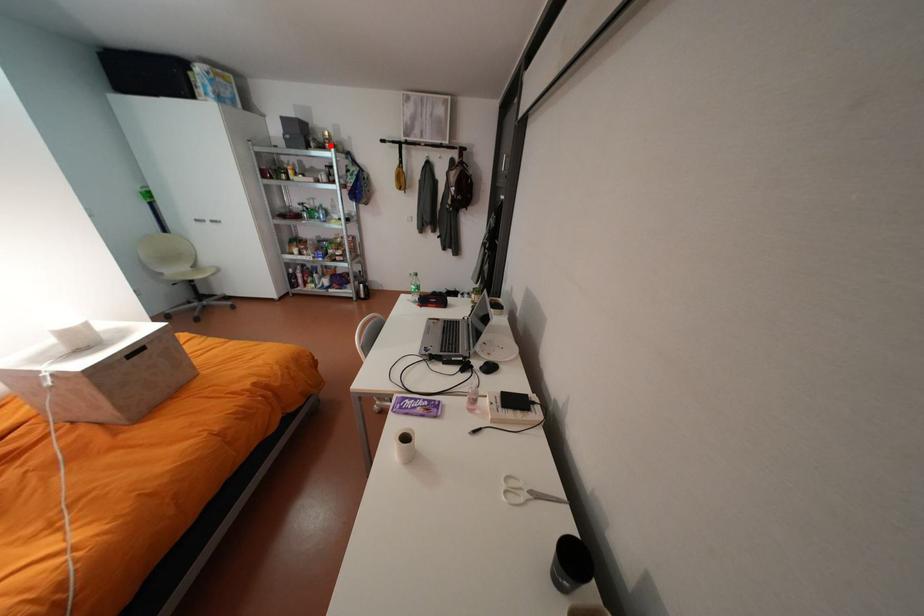
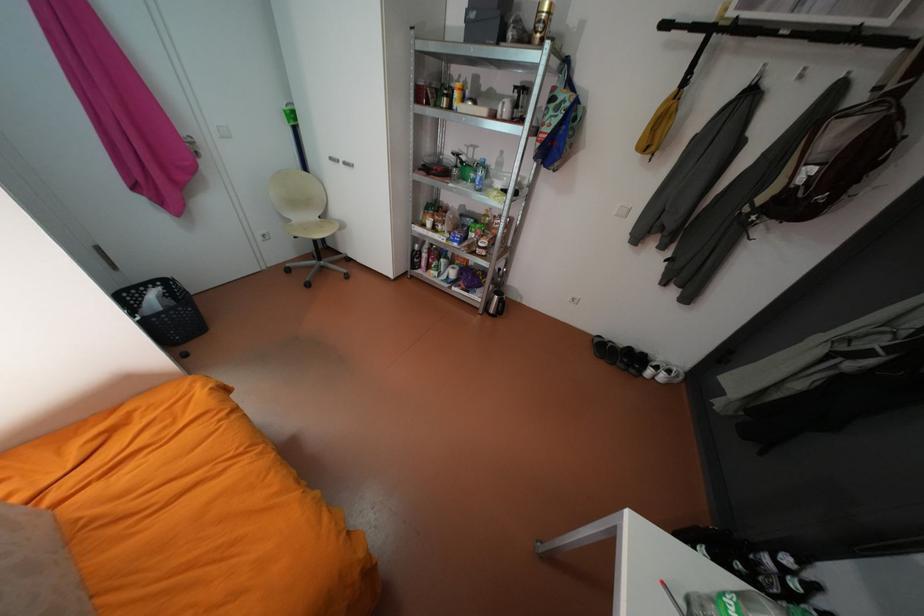
Question: I am providing you with two images of the same scene from different viewpoints. Image1 has a red point marked. In image2, the corresponding 3D location appears at what relative position? Reply with the corresponding letter.

Choices:
 (A) Closer
 (B) Farther

Answer: (B)